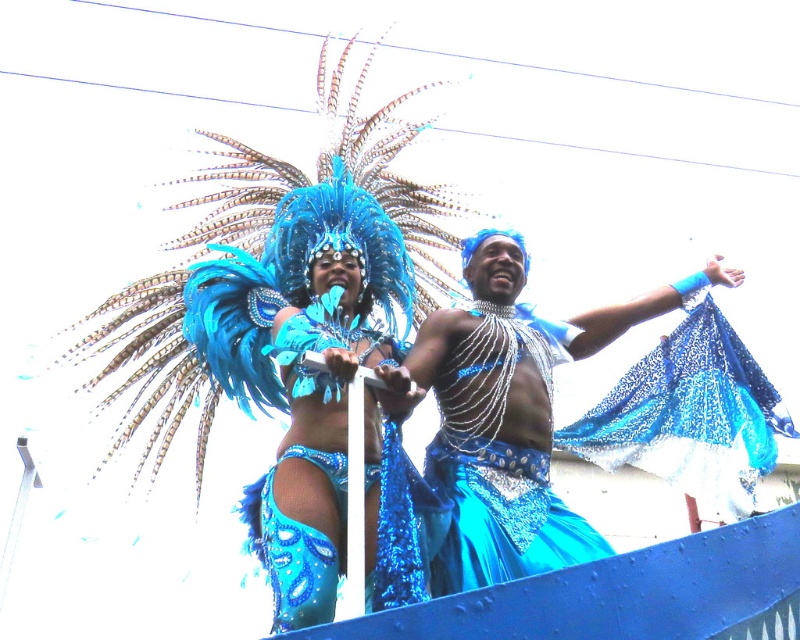
You are a photographer at a carnival. You want to capture the shiny blue costume at center in your photo. Where should you position yourself relative to the point marked at coordinates (x=322, y=381) to ensure the costume is the main focus?

Position yourself directly at the point marked at (x=322, y=381) to ensure the shiny blue costume at center is the main focus in your photo.

You are a photographer trying to capture both performers in a single frame. The shiny blue costume at center and the sparkly blue costume at center are both in the frame. Which performer should you focus on first if you want to ensure the taller one is in focus?

The shiny blue costume at center is taller than the sparkly blue costume at center, so you should focus on the shiny blue costume at center first to ensure the taller performer is in focus.